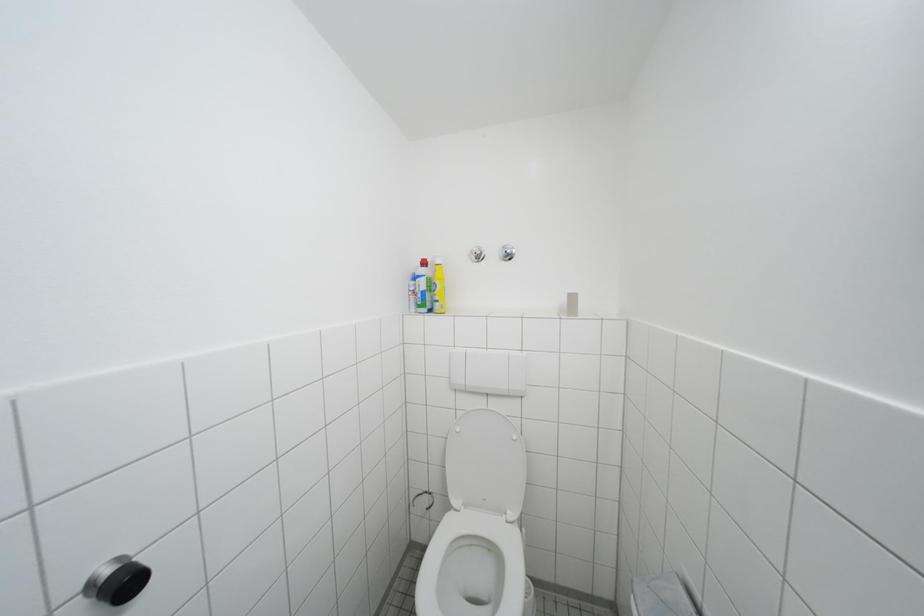
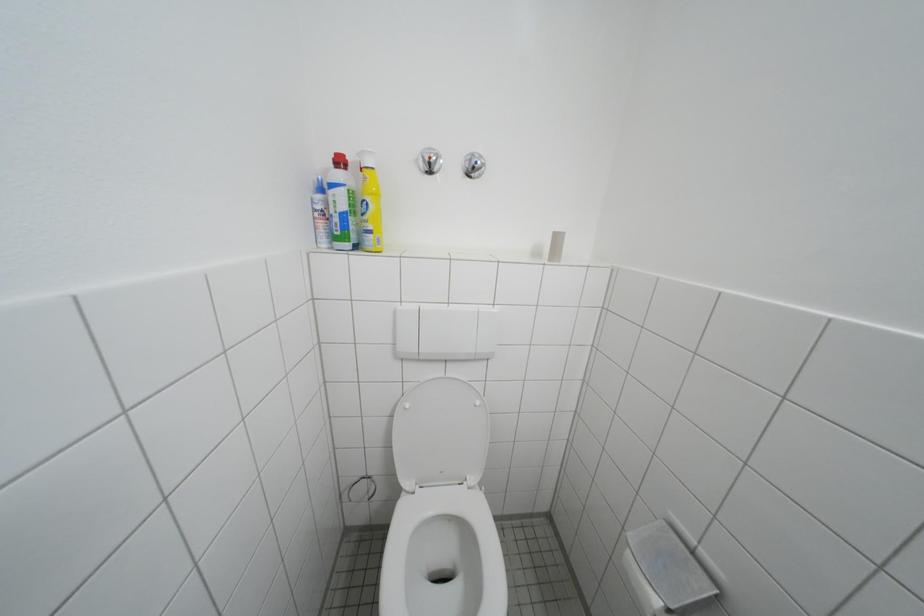
Question: The camera is either moving clockwise (left) or counter-clockwise (right) around the object. The first image is from the beginning of the video and the second image is from the end. Is the camera moving left or right when shooting the video?

Choices:
 (A) Left
 (B) Right

Answer: (A)